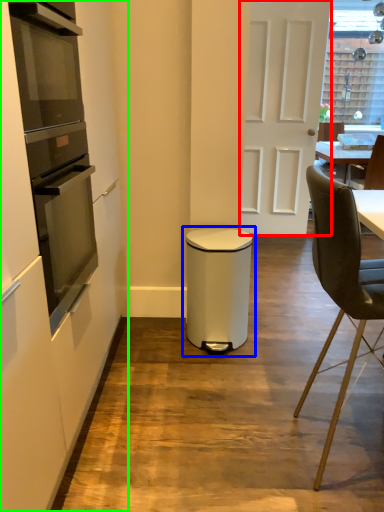
Question: Based on their relative distances, which object is farther from door (highlighted by a red box)? Choose from waste container (highlighted by a blue box) and cabinetry (highlighted by a green box).

Choices:
 (A) waste container
 (B) cabinetry

Answer: (B)